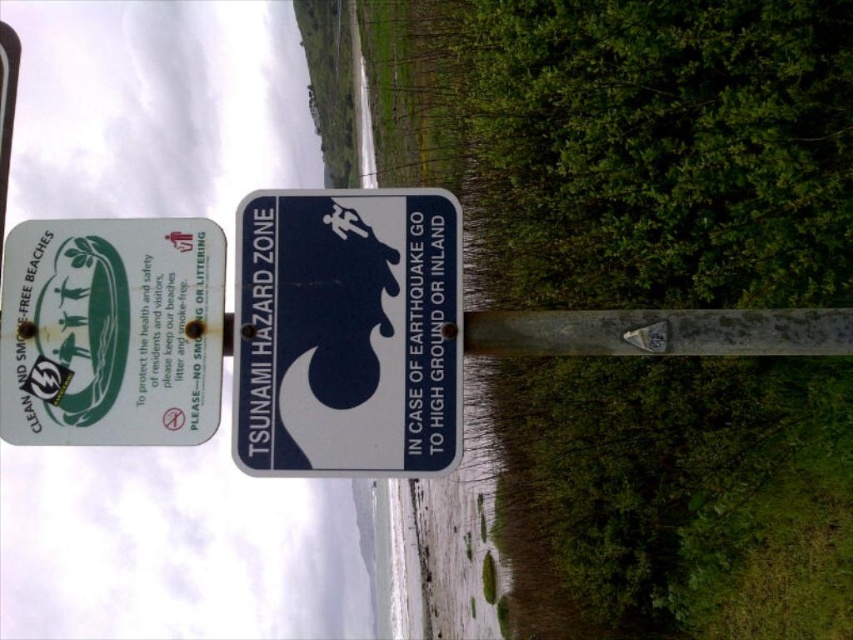
You are standing at the point marked by the coordinates point [347,332]. Which object is exactly at this location?

The white plastic sign at center is exactly at point [347,332].